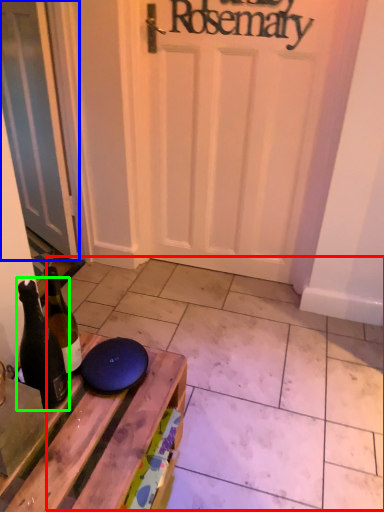
Question: Which object is positioned closest to tile (highlighted by a red box)? Select from door (highlighted by a blue box) and bottle (highlighted by a green box).

Choices:
 (A) door
 (B) bottle

Answer: (B)